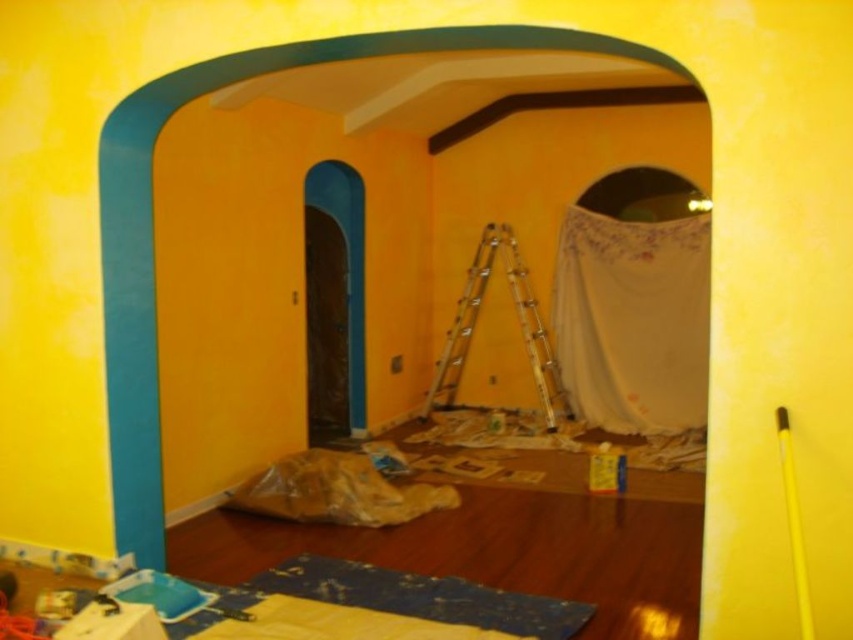
You are a painter holding a 30 inch wide paint roller. You need to move between the white lace curtain at center and the metallic silver ladder at center. Can you fit the paint roller between them without touching either object?

The distance between the white lace curtain at center and the metallic silver ladder at center is 27.25 inches. Since the paint roller is 30 inches wide, it cannot fit between them without touching either object.

You are standing in the room through the teal archway and looking towards the dark brown door. There is a point marked at coordinates (633, 321) in the image. Based on the scene description, what object is this point located on?

The point (633, 321) is located on the white lace curtain at center.

Looking at this image, you are standing in the room and want to hang a picture frame on the wall behind the white lace curtain at center. Can you hang it directly behind the curtain without moving the curtain?

The white lace curtain at center is located at point (633, 321), so you can hang the picture frame directly behind it as the curtain is translucent and does not block the wall space.